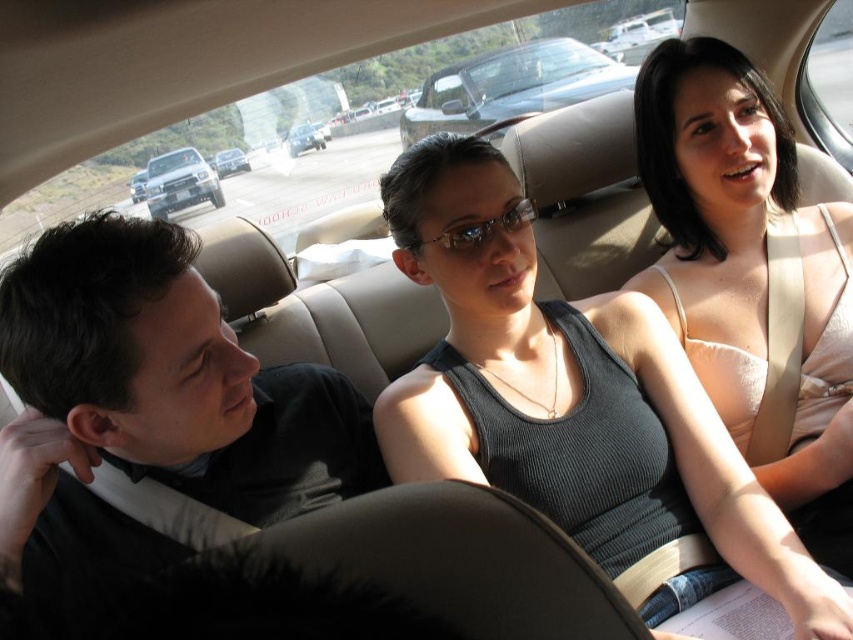
Who is positioned more to the right, matte black glasses at center or metallic silver sedan at center?

matte black glasses at center

This screenshot has height=640, width=853. Find the location of `matte black glasses at center`. matte black glasses at center is located at coordinates (479, 228).

You are a GUI agent. You are given a task and a screenshot of the screen. Output one action in this format:
    pyautogui.click(x=<x>, y=<y>)
    Task: Click on the matte black glasses at center
    Image resolution: width=853 pixels, height=640 pixels.
    Given the screenshot: What is the action you would take?
    pyautogui.click(x=479, y=228)

Is light beige fabric tank top at center positioned before silver metallic truck at upper left?

That is True.

Which is behind, point (637, 129) or point (196, 188)?

The point (196, 188) is behind.

Who is more forward, [761,289] or [171,150]?

Point [761,289] is in front.

At what (x,y) coordinates should I click in order to perform the action: click on light beige fabric tank top at center. Please return your answer as a coordinate pair (x, y). Looking at the image, I should click on (750, 276).

Does light beige fabric tank top at center appear on the right side of silver metallic convertible at center?

Yes, light beige fabric tank top at center is to the right of silver metallic convertible at center.

Who is higher up, light beige fabric tank top at center or silver metallic convertible at center?

silver metallic convertible at center is higher up.

What do you see at coordinates (750, 276) in the screenshot? The image size is (853, 640). I see `light beige fabric tank top at center` at bounding box center [750, 276].

The image size is (853, 640). What are the coordinates of `light beige fabric tank top at center` in the screenshot? It's located at click(750, 276).